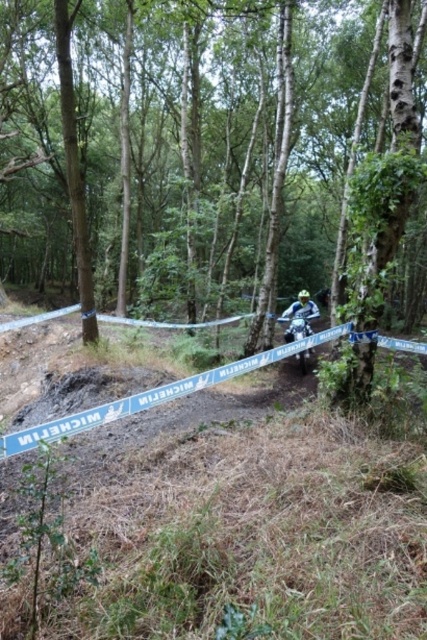
From the picture: Can you confirm if brown bark tree at center is shorter than blue metallic motorcycle at center?

No, brown bark tree at center is not shorter than blue metallic motorcycle at center.

Between brown bark tree at center and blue metallic motorcycle at center, which one is positioned lower?

blue metallic motorcycle at center is below.

The image size is (427, 640). Describe the element at coordinates (242, 172) in the screenshot. I see `brown bark tree at center` at that location.

This screenshot has height=640, width=427. I want to click on brown bark tree at center, so click(x=242, y=172).